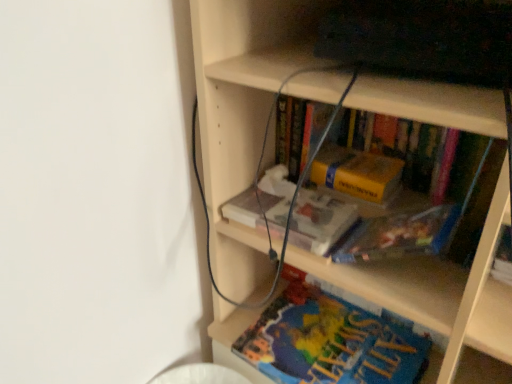
Identify the location of vacant area on top of blue matte book at lower center, which is counted as the 1th book, starting from the bottom (from a real-world perspective). (330, 338).